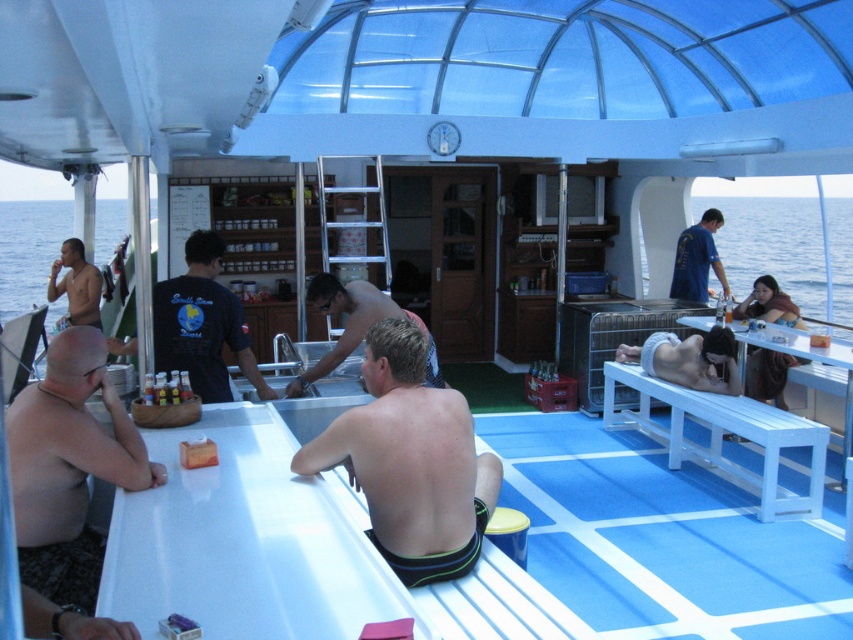
Is bald head at left to the right of shiny metallic sink at center from the viewer's perspective?

No, bald head at left is not to the right of shiny metallic sink at center.

Image resolution: width=853 pixels, height=640 pixels. What do you see at coordinates (68, 467) in the screenshot?
I see `bald head at left` at bounding box center [68, 467].

Where is `bald head at left`? bald head at left is located at coordinates (68, 467).

Between blue fabric shirt at upper right and shiny skin torso at left, which one is positioned lower?

shiny skin torso at left is below.

Is point (708, 243) closer to camera compared to point (77, 300)?

No, it is not.

Who is more forward, [712,230] or [85,285]?

Point [85,285] is in front.

Find the location of a particular element. Image resolution: width=853 pixels, height=640 pixels. blue fabric shirt at upper right is located at coordinates (697, 259).

Which is in front, point (416, 577) or point (685, 232)?

Positioned in front is point (416, 577).

Can you confirm if shiny black swim trunks at center is wider than blue fabric shirt at upper right?

Yes, shiny black swim trunks at center is wider than blue fabric shirt at upper right.

Is point (361, 442) farther from viewer compared to point (722, 266)?

No.

Where is `shiny black swim trunks at center`? shiny black swim trunks at center is located at coordinates (410, 461).